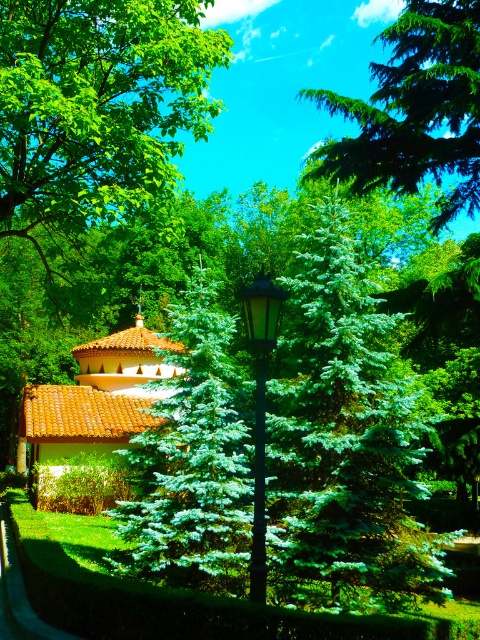
Based on the photo, is green needle-like tree at upper center shorter than green grass at lower left?

Incorrect, green needle-like tree at upper center's height does not fall short of green grass at lower left's.

Is point (371, 161) farther from viewer compared to point (0, 630)?

Yes, it is behind point (0, 630).

Is point (432, 224) closer to camera compared to point (14, 566)?

That is False.

This screenshot has height=640, width=480. I want to click on green needle-like tree at upper center, so click(415, 109).